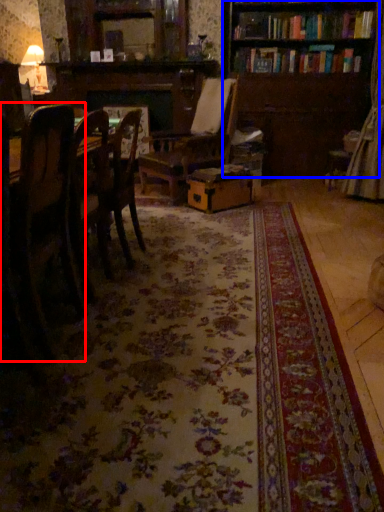
Question: Among these objects, which one is farthest to the camera, chair (highlighted by a red box) or bookcase (highlighted by a blue box)?

Choices:
 (A) chair
 (B) bookcase

Answer: (B)